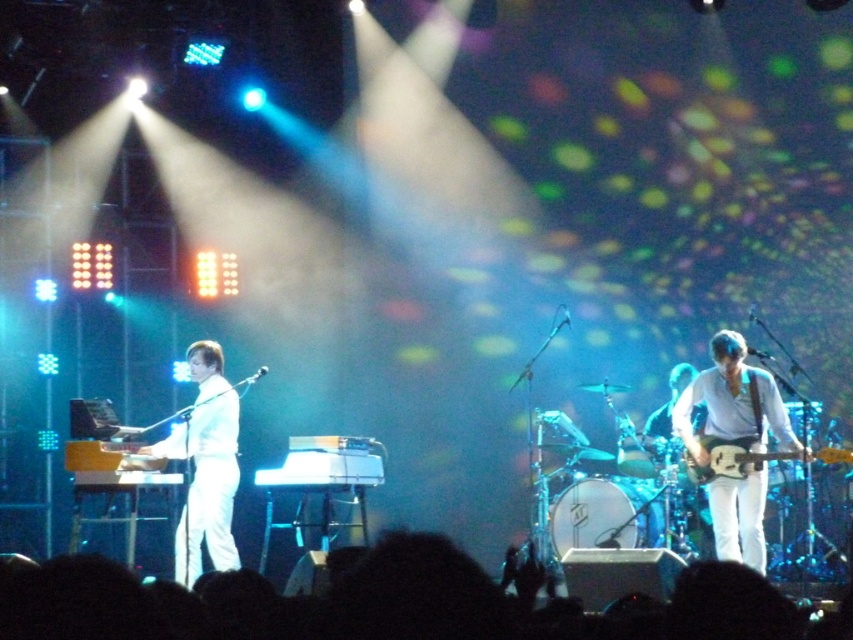
You are a stagehand standing at point (724, 560). You need to reach the keyboardist on the left and the guitarist on the right. Which musician is closer to you?

The keyboardist on the left is closer to you because they are only 5.98 meters away from the point (724, 560).

You are a photographer positioned at the camera. You need to capture a closeup shot of the white matte guitar at right. Considering the distance between the camera and the guitar, is it feasible to use a standard 50mm lens for this shot?

The white matte guitar at right and camera are 5.78 meters apart from each other. A standard 50mm lens typically requires a minimum focusing distance of about 0.3 meters and can focus on subjects at distances up to several meters. Since 5.78 meters is within the focusing range of a 50mm lens, it is feasible to use it for capturing a closeup shot of the white matte guitar at right.